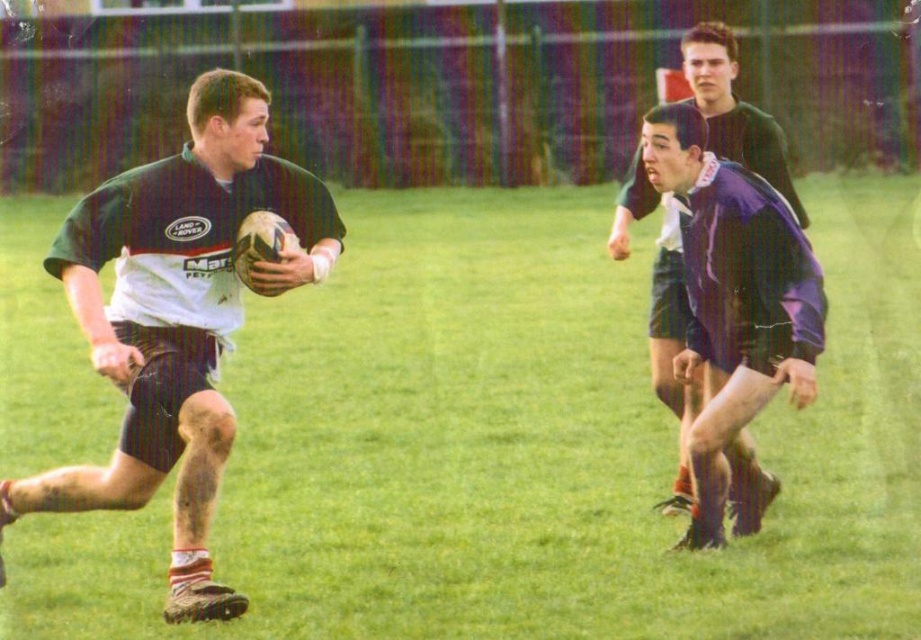
This screenshot has width=921, height=640. Describe the element at coordinates (177, 317) in the screenshot. I see `matte green rugby ball at left` at that location.

Is matte green rugby ball at left positioned behind purple fabric shorts at right?

No.

Does point (188, 566) come behind point (686, 509)?

No, (188, 566) is closer to viewer.

Find the location of a particular element. The width and height of the screenshot is (921, 640). matte green rugby ball at left is located at coordinates (177, 317).